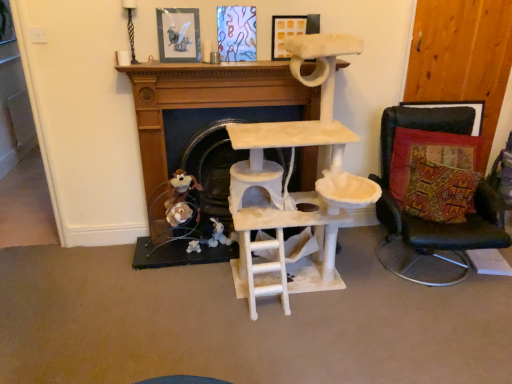
Describe the element at coordinates (181, 188) in the screenshot. The width and height of the screenshot is (512, 384). I see `fuzzy brown plush at lower center` at that location.

The height and width of the screenshot is (384, 512). Describe the element at coordinates (178, 34) in the screenshot. I see `matte glass picture frame at upper center, which is the 1th picture frame in left-to-right order` at that location.

What do you see at coordinates (291, 31) in the screenshot? I see `matte yellow picture frame at upper center, which is the 2th picture frame from left to right` at bounding box center [291, 31].

At what (x,y) coordinates should I click in order to perform the action: click on beige fabric cat tree at center. Please return your answer as a coordinate pair (x, y). The width and height of the screenshot is (512, 384). Looking at the image, I should click on (201, 128).

In the image, is beige fabric cat tree at center on the left side or the right side of black leather chair at right?

From the image, it's evident that beige fabric cat tree at center is to the left of black leather chair at right.

Are beige fabric cat tree at center and black leather chair at right making contact?

No, beige fabric cat tree at center is not touching black leather chair at right.

Considering the positions of point (196, 152) and point (409, 262), is point (196, 152) closer or farther from the camera than point (409, 262)?

Point (196, 152).

From the image's perspective, is beige fabric cat tree at center beneath black leather chair at right?

Incorrect, from the image's perspective, beige fabric cat tree at center is higher than black leather chair at right.

Which is less distant, (276,18) or (149,202)?

Point (276,18).

You are a GUI agent. You are given a task and a screenshot of the screen. Output one action in this format:
    pyautogui.click(x=<x>, y=<y>)
    Task: Click on the fireplace in front of the matte yellow picture frame at upper center, which is the 2th picture frame from left to right
    This screenshot has height=384, width=512.
    Given the screenshot: What is the action you would take?
    pyautogui.click(x=201, y=128)

Is matte yellow picture frame at upper center, placed as the 1th picture frame when sorted from right to left, outside of beige fabric cat tree at center?

matte yellow picture frame at upper center, placed as the 1th picture frame when sorted from right to left, is positioned outside beige fabric cat tree at center.

From the picture: Can you confirm if matte yellow picture frame at upper center, placed as the 1th picture frame when sorted from right to left, is wider than beige fabric cat tree at center?

No.

How distant is black leather chair at right from matte glass picture frame at upper center, the 2th picture frame viewed from the right?

They are 1.56 meters apart.

In the scene shown: From the image's perspective, which is above, black leather chair at right or matte glass picture frame at upper center, the 2th picture frame viewed from the right?

matte glass picture frame at upper center, the 2th picture frame viewed from the right.

Is black leather chair at right looking in the opposite direction of matte glass picture frame at upper center, the 2th picture frame viewed from the right?

No.

Locate an element on the screen. chair on the right of matte glass picture frame at upper center, the 2th picture frame viewed from the right is located at coordinates (431, 221).

Is black leather chair at right inside matte glass picture frame at upper center, which is the 1th picture frame in left-to-right order?

No, black leather chair at right is not surrounded by matte glass picture frame at upper center, which is the 1th picture frame in left-to-right order.

Is point (193, 12) closer to viewer compared to point (378, 203)?

Yes, it is in front of point (378, 203).

Are matte glass picture frame at upper center, which is the 1th picture frame in left-to-right order, and black leather chair at right beside each other?

No, matte glass picture frame at upper center, which is the 1th picture frame in left-to-right order, is not making contact with black leather chair at right.

Is matte glass picture frame at upper center, which is the 1th picture frame in left-to-right order, positioned with its back to black leather chair at right?

No, matte glass picture frame at upper center, which is the 1th picture frame in left-to-right order, is not facing the opposite direction of black leather chair at right.

Would you consider matte yellow picture frame at upper center, placed as the 1th picture frame when sorted from right to left, to be distant from matte glass picture frame at upper center, the 2th picture frame viewed from the right?

No, matte yellow picture frame at upper center, placed as the 1th picture frame when sorted from right to left, is not far away from matte glass picture frame at upper center, the 2th picture frame viewed from the right.

Is matte yellow picture frame at upper center, placed as the 1th picture frame when sorted from right to left, oriented away from matte glass picture frame at upper center, the 2th picture frame viewed from the right?

That's not correct — matte yellow picture frame at upper center, placed as the 1th picture frame when sorted from right to left, is not looking away from matte glass picture frame at upper center, the 2th picture frame viewed from the right.

Which is more to the right, matte yellow picture frame at upper center, placed as the 1th picture frame when sorted from right to left, or matte glass picture frame at upper center, the 2th picture frame viewed from the right?

Positioned to the right is matte yellow picture frame at upper center, placed as the 1th picture frame when sorted from right to left.

At what (x,y) coordinates should I click in order to perform the action: click on picture frame that is above the matte glass picture frame at upper center, the 2th picture frame viewed from the right (from the image's perspective). Please return your answer as a coordinate pair (x, y). Looking at the image, I should click on (291, 31).

How much distance is there between black leather chair at right and matte yellow picture frame at upper center, which is the 2th picture frame from left to right?

The distance of black leather chair at right from matte yellow picture frame at upper center, which is the 2th picture frame from left to right, is 3.59 feet.

From a real-world perspective, is black leather chair at right physically below matte yellow picture frame at upper center, placed as the 1th picture frame when sorted from right to left?

Yes, from a real-world perspective, black leather chair at right is below matte yellow picture frame at upper center, placed as the 1th picture frame when sorted from right to left.

Which of these two, black leather chair at right or matte yellow picture frame at upper center, placed as the 1th picture frame when sorted from right to left, is wider?

Wider between the two is black leather chair at right.

Is black leather chair at right placed right next to matte yellow picture frame at upper center, placed as the 1th picture frame when sorted from right to left?

They are not placed beside each other.

From the image's perspective, is multicolored woven cushion at right under matte yellow picture frame at upper center, which is the 2th picture frame from left to right?

Correct, multicolored woven cushion at right appears lower than matte yellow picture frame at upper center, which is the 2th picture frame from left to right, in the image.

Is multicolored woven cushion at right completely or partially outside of matte yellow picture frame at upper center, which is the 2th picture frame from left to right?

Indeed, multicolored woven cushion at right is completely outside matte yellow picture frame at upper center, which is the 2th picture frame from left to right.

Looking at this image, from a real-world perspective, who is located higher, multicolored woven cushion at right or matte yellow picture frame at upper center, which is the 2th picture frame from left to right?

In real-world perspective, matte yellow picture frame at upper center, which is the 2th picture frame from left to right, is above.

Is multicolored woven cushion at right positioned in front of matte yellow picture frame at upper center, placed as the 1th picture frame when sorted from right to left?

Yes, it is in front of matte yellow picture frame at upper center, placed as the 1th picture frame when sorted from right to left.

The image size is (512, 384). Identify the location of fireplace behind the black leather chair at right. coord(201,128).

The width and height of the screenshot is (512, 384). What are the coordinates of `picture frame that is the 2nd one when counting upward from the beige fabric cat tree at center (from the image's perspective)` in the screenshot? It's located at (291, 31).

From the picture: Which object lies further to the anchor point fuzzy brown plush at lower center, beige fabric cat tree at center or black leather chair at right?

Among the two, black leather chair at right is located further to fuzzy brown plush at lower center.

When comparing their distances from matte glass picture frame at upper center, the 2th picture frame viewed from the right, does matte yellow picture frame at upper center, which is the 2th picture frame from left to right, or multicolored woven cushion at right seem closer?

matte yellow picture frame at upper center, which is the 2th picture frame from left to right, is closer to matte glass picture frame at upper center, the 2th picture frame viewed from the right.

Considering their positions, is beige fabric cat tree at center positioned further to black leather chair at right than matte yellow picture frame at upper center, placed as the 1th picture frame when sorted from right to left?

matte yellow picture frame at upper center, placed as the 1th picture frame when sorted from right to left.

Which object lies nearer to the anchor point multicolored woven cushion at right, matte glass picture frame at upper center, which is the 1th picture frame in left-to-right order, or fuzzy brown plush at lower center?

fuzzy brown plush at lower center is closer to multicolored woven cushion at right.

When comparing their distances from matte glass picture frame at upper center, which is the 1th picture frame in left-to-right order, does beige fabric cat tree at center or black leather chair at right seem further?

Among the two, black leather chair at right is located further to matte glass picture frame at upper center, which is the 1th picture frame in left-to-right order.

Which object lies further to the anchor point multicolored woven cushion at right, matte yellow picture frame at upper center, which is the 2th picture frame from left to right, or matte glass picture frame at upper center, the 2th picture frame viewed from the right?

Based on the image, matte glass picture frame at upper center, the 2th picture frame viewed from the right, appears to be further to multicolored woven cushion at right.

From the image, which object appears to be nearer to matte yellow picture frame at upper center, placed as the 1th picture frame when sorted from right to left, multicolored woven cushion at right or beige fabric cat tree at center?

Based on the image, beige fabric cat tree at center appears to be nearer to matte yellow picture frame at upper center, placed as the 1th picture frame when sorted from right to left.

When comparing their distances from beige fabric cat tree at center, does matte glass picture frame at upper center, which is the 1th picture frame in left-to-right order, or black leather chair at right seem closer?

matte glass picture frame at upper center, which is the 1th picture frame in left-to-right order, is closer to beige fabric cat tree at center.

You are a GUI agent. You are given a task and a screenshot of the screen. Output one action in this format:
    pyautogui.click(x=<x>, y=<y>)
    Task: Click on the fireplace between matte glass picture frame at upper center, which is the 1th picture frame in left-to-right order, and fuzzy brown plush at lower center, in the vertical direction
    This screenshot has height=384, width=512.
    Given the screenshot: What is the action you would take?
    pyautogui.click(x=201, y=128)

The image size is (512, 384). Identify the location of toy situated between matte glass picture frame at upper center, the 2th picture frame viewed from the right, and multicolored woven cushion at right from left to right. 181,188.

The width and height of the screenshot is (512, 384). Identify the location of fireplace located between matte glass picture frame at upper center, the 2th picture frame viewed from the right, and black leather chair at right in the left-right direction. (201, 128).

Identify the location of picture frame between beige fabric cat tree at center and black leather chair at right. This screenshot has width=512, height=384. (291, 31).